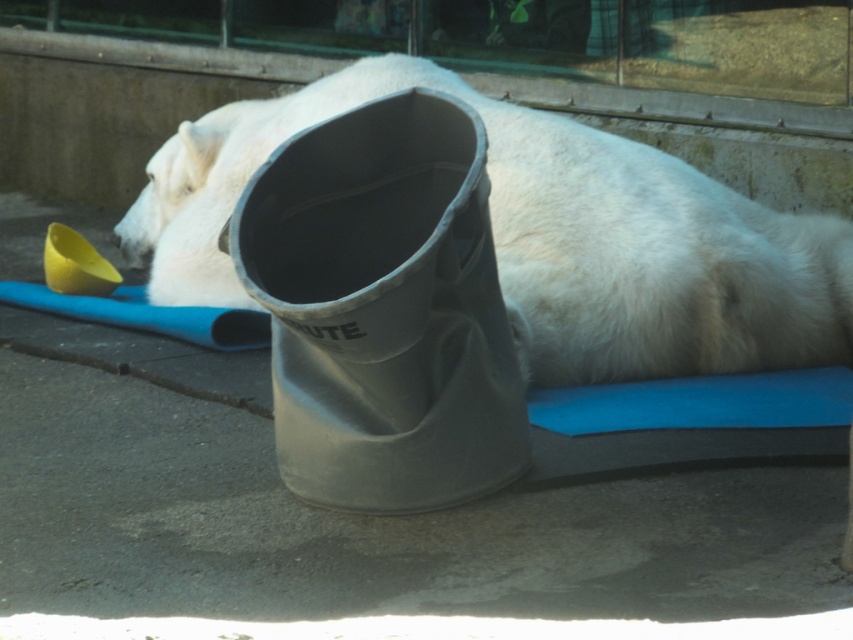
You are a zookeeper planning to place a new feeding station in the enclosure. The feeding station must be placed at least 2 meters away from the white matte polar bear at center. Given the polar bear is at coordinates point 0.373, 0.637, can you determine if a proposed feeding station location at point 0.5, 0.5 is safe?

The white matte polar bear at center is located at point (543, 237). The proposed feeding station at point (426, 320) is less than 2 meters away, so it does not meet the safety requirement.

You are standing at the entrance of the polar bear enclosure and want to locate two specific points marked in the image. The first point is at coordinate point [138,259] and the second is at point [431,403]. Which of these two points is closer to you?

Point [138,259] is closer to you because it is further to the viewer than point [431,403].